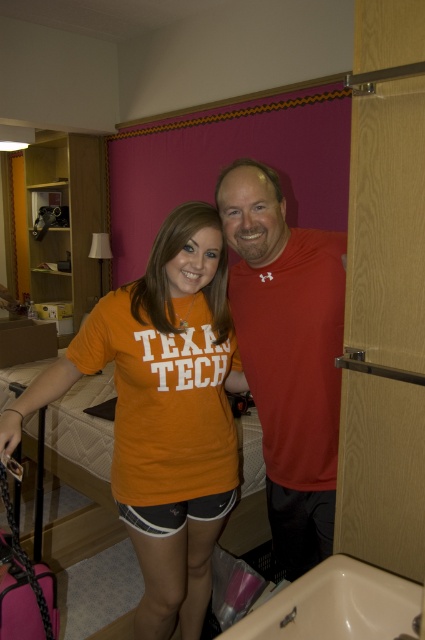
Can you confirm if orange cotton t-shirt at center is wider than matte red t-shirt at center?

Yes.

Who is more distant from viewer, (x=127, y=436) or (x=295, y=397)?

Positioned behind is point (x=127, y=436).

You are a GUI agent. You are given a task and a screenshot of the screen. Output one action in this format:
    pyautogui.click(x=<x>, y=<y>)
    Task: Click on the orange cotton t-shirt at center
    The image size is (425, 640).
    Given the screenshot: What is the action you would take?
    (164, 412)